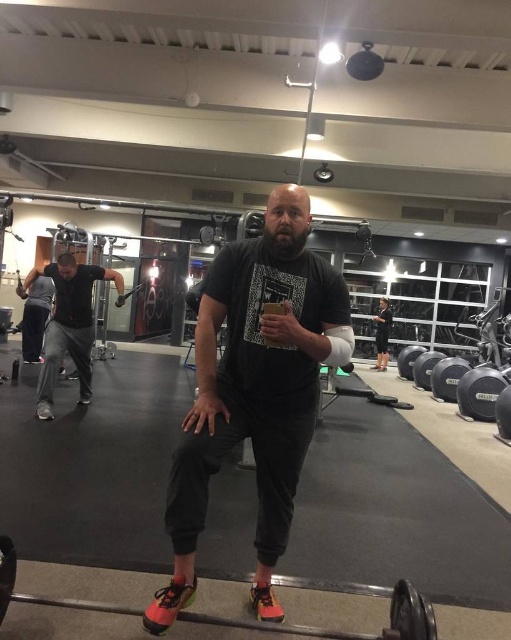
Question: Which of these objects is positioned closest to the black matte t-shirt at center?

Choices:
 (A) black rubber barbell at center
 (B) matte black t-shirt at center

Answer: (B)

Question: Can you confirm if black rubber barbell at center is positioned to the left of black matte t-shirt at center?

Choices:
 (A) yes
 (B) no

Answer: (B)

Question: Can you confirm if matte black t-shirt at center is positioned above black rubber barbell at center?

Choices:
 (A) no
 (B) yes

Answer: (B)

Question: Where is matte black t-shirt at center located in relation to black rubber barbell at center in the image?

Choices:
 (A) above
 (B) below

Answer: (A)

Question: Which object appears farthest from the camera in this image?

Choices:
 (A) black matte t-shirt at center
 (B) black rubber barbell at center

Answer: (A)

Question: Considering the real-world distances, which object is closest to the black matte t-shirt at center?

Choices:
 (A) black rubber barbell at center
 (B) matte black t-shirt at center

Answer: (B)